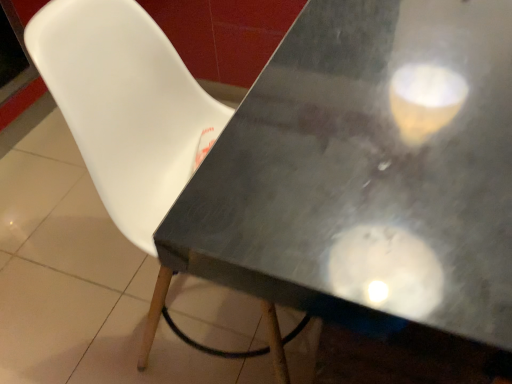
This screenshot has height=384, width=512. Describe the element at coordinates (125, 106) in the screenshot. I see `white plastic chair at center` at that location.

Measure the distance between point (129, 66) and camera.

33.90 inches.

The width and height of the screenshot is (512, 384). I want to click on white plastic chair at center, so click(x=125, y=106).

This screenshot has height=384, width=512. I want to click on white plastic chair at center, so click(x=125, y=106).